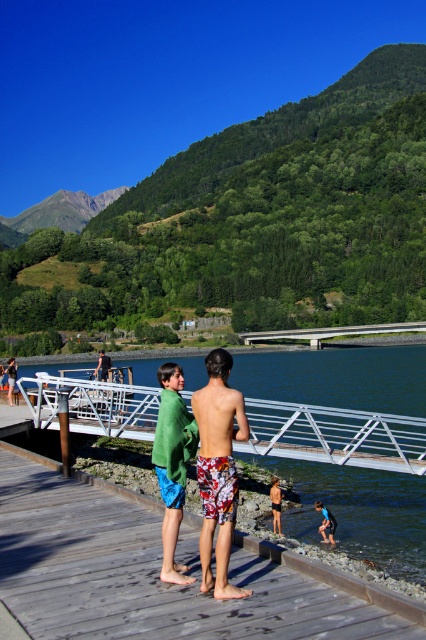
Question: Which object appears farthest from the camera in this image?

Choices:
 (A) blue swim trunks at lower right
 (B) wooden dock at center
 (C) floral-patterned swim trunks at center
 (D) white concrete bridge at center

Answer: (D)

Question: Is wooden dock at center smaller than floral-patterned swim trunks at center?

Choices:
 (A) yes
 (B) no

Answer: (A)

Question: Does wooden dock at center come behind white concrete bridge at center?

Choices:
 (A) no
 (B) yes

Answer: (A)

Question: Does floral-patterned swim trunks at center appear on the left side of shiny metallic pole at center?

Choices:
 (A) no
 (B) yes

Answer: (A)

Question: Among these points, which one is nearest to the camera?

Choices:
 (A) tap(371, 333)
 (B) tap(120, 545)
 (C) tap(169, 465)
 (D) tap(325, 512)

Answer: (C)

Question: Which point is closer to the camera?

Choices:
 (A) floral-patterned swim trunks at center
 (B) green towel at center
 (C) white concrete bridge at center
 (D) clear water at center

Answer: (A)